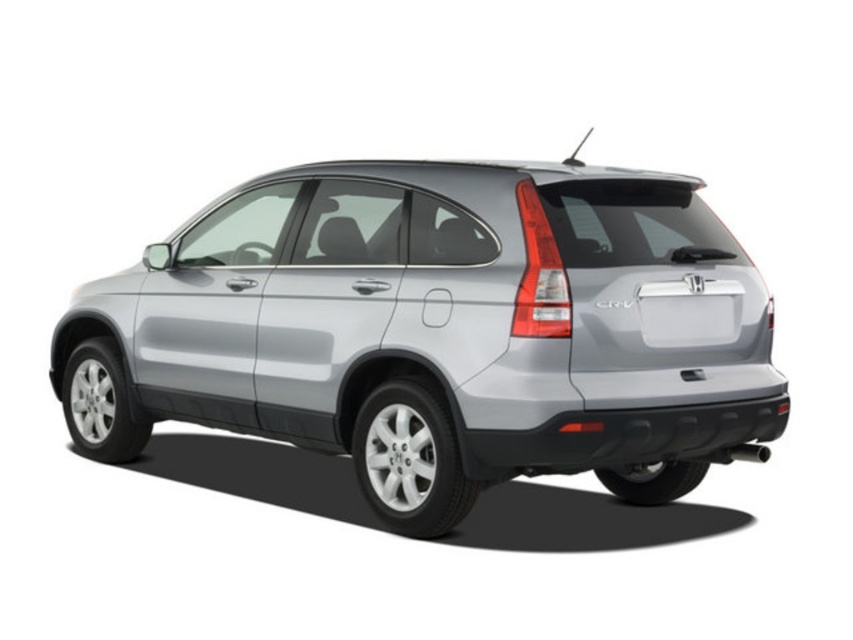
Question: Among these objects, which one is nearest to the camera?

Choices:
 (A) satin silver suv at center
 (B) white plastic license plate at rear

Answer: (A)

Question: Can you confirm if satin silver suv at center is bigger than white plastic license plate at rear?

Choices:
 (A) yes
 (B) no

Answer: (A)

Question: Which point appears closest to the camera in this image?

Choices:
 (A) (637, 381)
 (B) (740, 298)

Answer: (A)

Question: Can you confirm if satin silver suv at center is positioned below white plastic license plate at rear?

Choices:
 (A) no
 (B) yes

Answer: (B)

Question: Where is satin silver suv at center located in relation to white plastic license plate at rear in the image?

Choices:
 (A) above
 (B) below

Answer: (B)